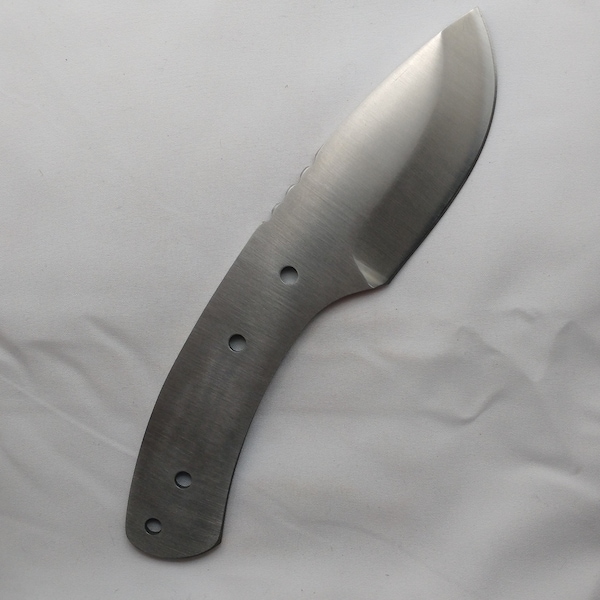
Locate an element on the screen. The image size is (600, 600). white cloth is located at coordinates (551, 256).